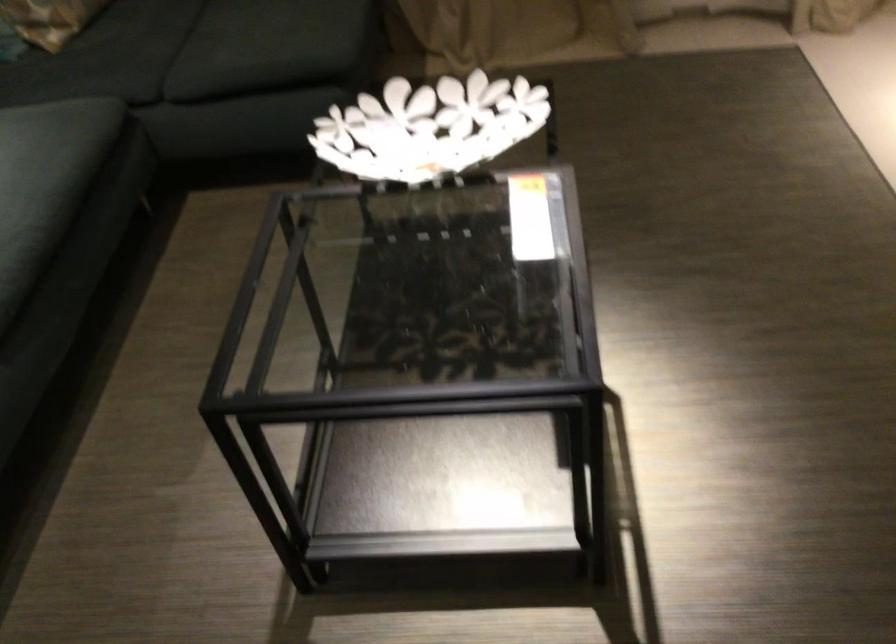
Where is `white decorative bowl`? Image resolution: width=896 pixels, height=644 pixels. white decorative bowl is located at coordinates (429, 127).